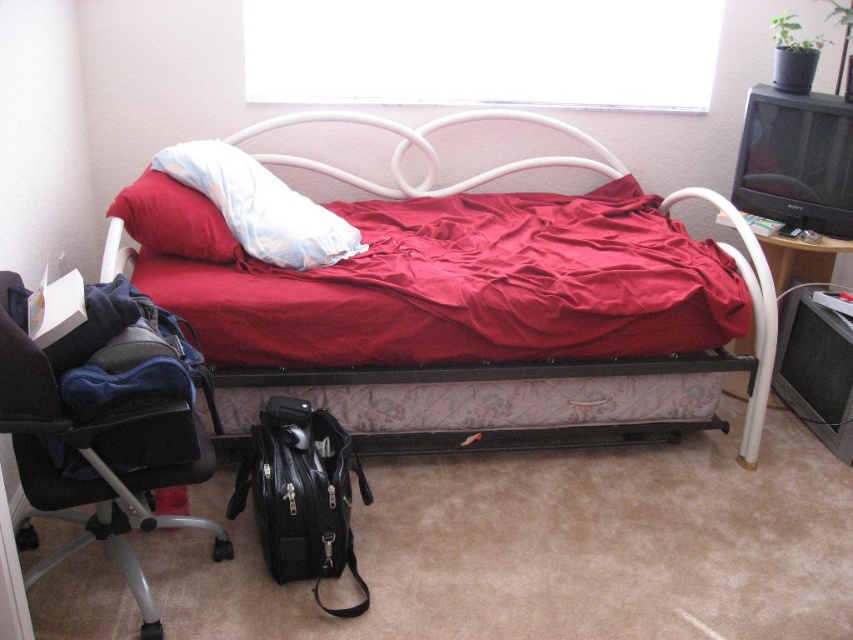
Question: Is red matte blanket at center thinner than white soft pillow at center?

Choices:
 (A) no
 (B) yes

Answer: (A)

Question: Is black leather chair at lower left above black leather bag at lower center?

Choices:
 (A) yes
 (B) no

Answer: (A)

Question: Which is farther from the soft white pillow at upper left?

Choices:
 (A) white soft pillow at center
 (B) red matte blanket at center

Answer: (B)

Question: Among these points, which one is nearest to the camera?

Choices:
 (A) (347, 554)
 (B) (108, 211)

Answer: (A)

Question: Which object appears farthest from the camera in this image?

Choices:
 (A) soft white pillow at upper left
 (B) red matte bed at center
 (C) black leather bag at lower center

Answer: (B)

Question: Does black leather chair at lower left appear under soft white pillow at upper left?

Choices:
 (A) yes
 (B) no

Answer: (A)